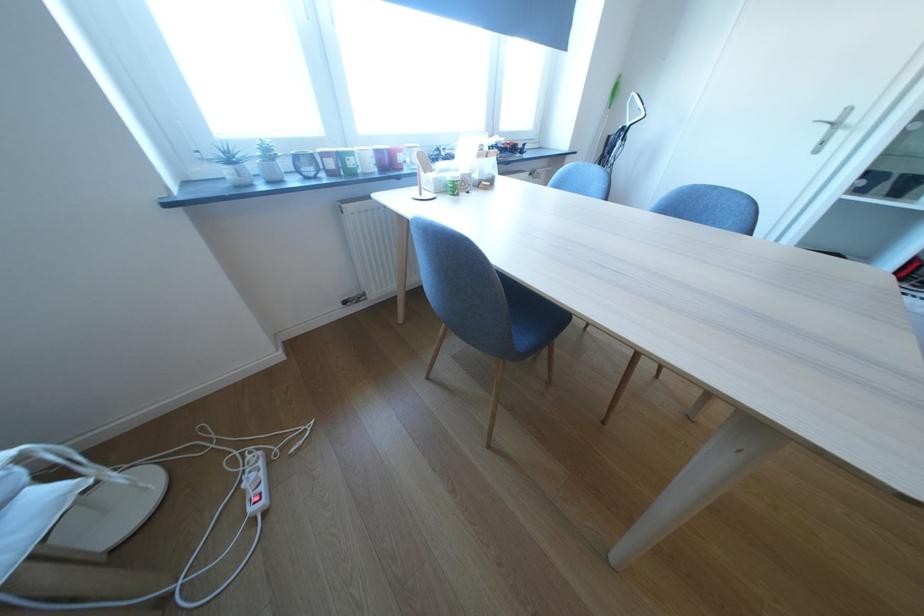
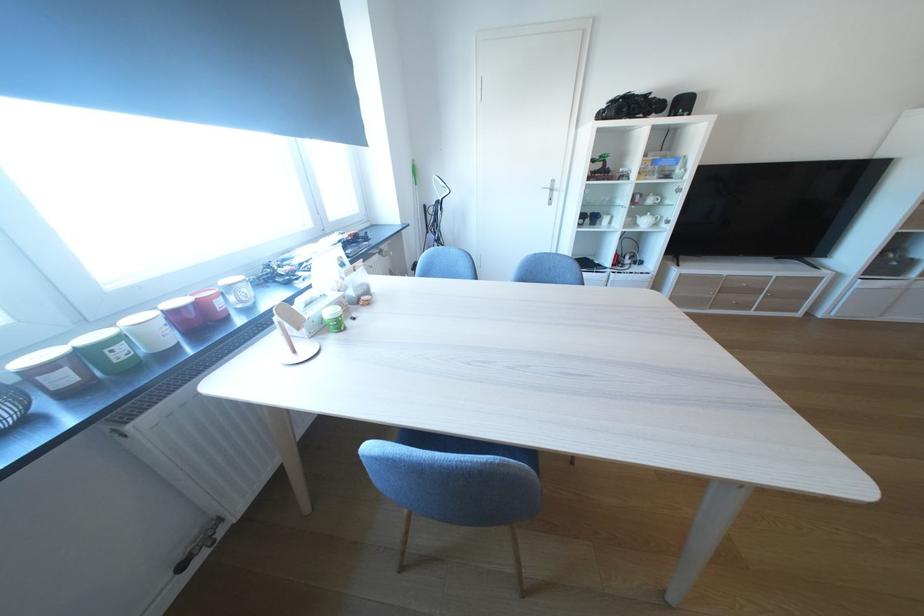
Question: The camera is either moving clockwise (left) or counter-clockwise (right) around the object. The first image is from the beginning of the video and the second image is from the end. Is the camera moving left or right when shooting the video?

Choices:
 (A) Left
 (B) Right

Answer: (A)